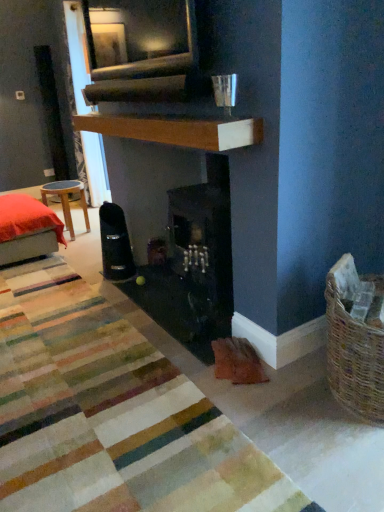
Question: Is velvet red cushion at left facing away from white textured curtain at upper left?

Choices:
 (A) no
 (B) yes

Answer: (A)

Question: Is white textured curtain at upper left a part of velvet red cushion at left?

Choices:
 (A) no
 (B) yes

Answer: (A)

Question: Is velvet red cushion at left not inside white textured curtain at upper left?

Choices:
 (A) yes
 (B) no

Answer: (A)

Question: From a real-world perspective, is velvet red cushion at left located higher than white textured curtain at upper left?

Choices:
 (A) yes
 (B) no

Answer: (B)

Question: Is velvet red cushion at left not near white textured curtain at upper left?

Choices:
 (A) yes
 (B) no

Answer: (B)

Question: Considering the positions of white textured curtain at upper left and wooden mantle at upper center in the image, is white textured curtain at upper left bigger or smaller than wooden mantle at upper center?

Choices:
 (A) small
 (B) big

Answer: (B)

Question: Is white textured curtain at upper left taller or shorter than wooden mantle at upper center?

Choices:
 (A) tall
 (B) short

Answer: (A)

Question: In the image, is white textured curtain at upper left on the left side or the right side of wooden mantle at upper center?

Choices:
 (A) left
 (B) right

Answer: (A)

Question: Looking at their shapes, would you say white textured curtain at upper left is wider or thinner than wooden mantle at upper center?

Choices:
 (A) thin
 (B) wide

Answer: (B)

Question: In terms of height, does wooden mantle at upper center look taller or shorter compared to wooden stool at left?

Choices:
 (A) short
 (B) tall

Answer: (A)

Question: Considering their positions, is wooden mantle at upper center located in front of or behind wooden stool at left?

Choices:
 (A) front
 (B) behind

Answer: (A)

Question: Choose the correct answer: Is wooden mantle at upper center inside wooden stool at left or outside it?

Choices:
 (A) inside
 (B) outside

Answer: (B)

Question: Is point coord(94,124) positioned closer to the camera than point coord(66,225)?

Choices:
 (A) closer
 (B) farther

Answer: (A)

Question: Is point (84, 30) closer or farther from the camera than point (66, 287)?

Choices:
 (A) closer
 (B) farther

Answer: (A)

Question: From a real-world perspective, is white textured curtain at upper left above or below striped wool rug at center?

Choices:
 (A) below
 (B) above

Answer: (B)